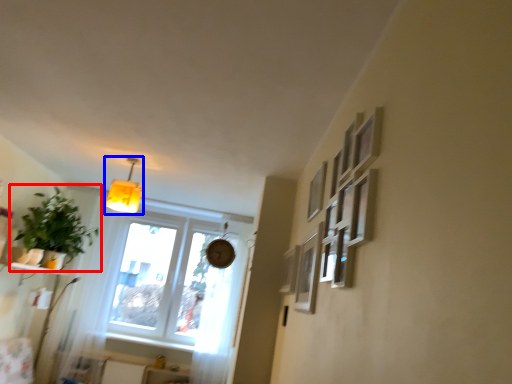
Question: Which object appears farthest to the camera in this image, houseplant (highlighted by a red box) or lamp (highlighted by a blue box)?

Choices:
 (A) houseplant
 (B) lamp

Answer: (A)